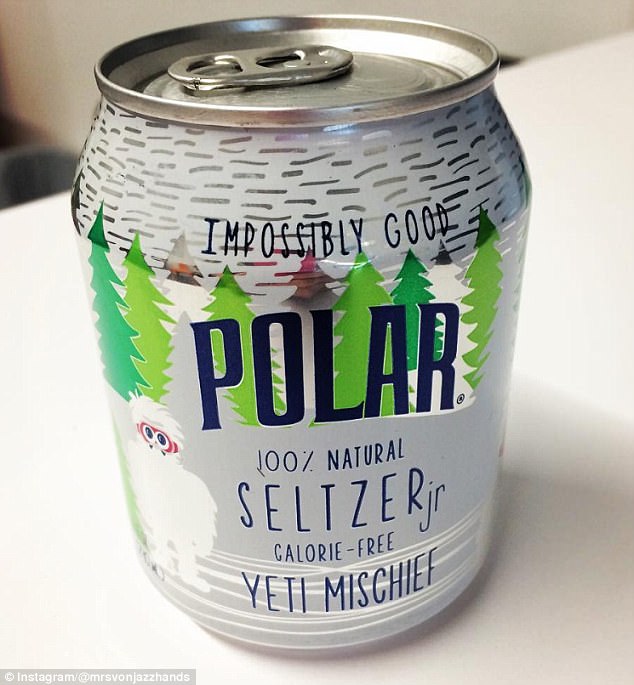
Find the location of a particular element. counter top is located at coordinates (569, 506).